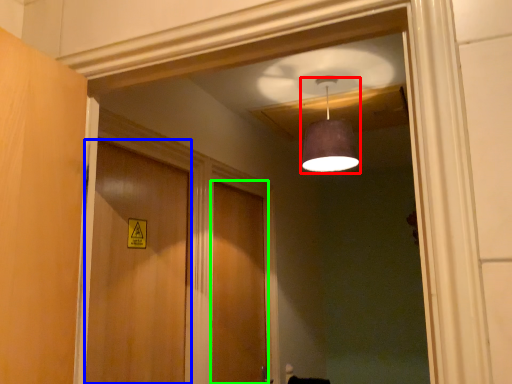
Question: Estimate the real-world distances between objects in this image. Which object is closer to light fixture (highlighted by a red box), door (highlighted by a blue box) or door (highlighted by a green box)?

Choices:
 (A) door
 (B) door

Answer: (A)